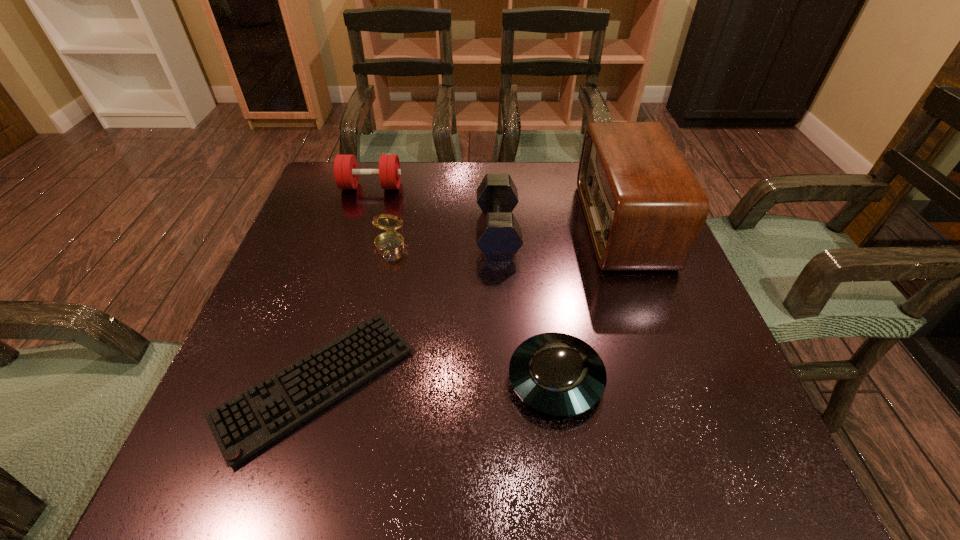
Find the location of a particular element. The width and height of the screenshot is (960, 540). the rightmost object is located at coordinates (644, 208).

At what (x,y) coordinates should I click in order to perform the action: click on the tallest object. Please return your answer as a coordinate pair (x, y). Image resolution: width=960 pixels, height=540 pixels. Looking at the image, I should click on (644, 208).

Identify the location of the nearer dumbbell. The image size is (960, 540). (499, 236).

Find the location of `the farther dumbbell`. the farther dumbbell is located at coordinates (346, 173).

Where is `compass`? compass is located at coordinates (389, 243).

You are a GUI agent. You are given a task and a screenshot of the screen. Output one action in this format:
    pyautogui.click(x=<x>, y=<y>)
    Task: Click on the saucer
    The height and width of the screenshot is (540, 960).
    Given the screenshot: What is the action you would take?
    pyautogui.click(x=557, y=374)

Identify the location of the shortest object. The height and width of the screenshot is (540, 960). (243, 425).

Locate an element on the screen. vacant space located 0.340m on the front panel of the radio receiver is located at coordinates (447, 225).

This screenshot has width=960, height=540. Find the location of `free spot located 0.230m on the front panel of the radio receiver`. free spot located 0.230m on the front panel of the radio receiver is located at coordinates (492, 225).

This screenshot has height=540, width=960. Identify the location of vacant space situated on the front panel of the radio receiver. (484, 225).